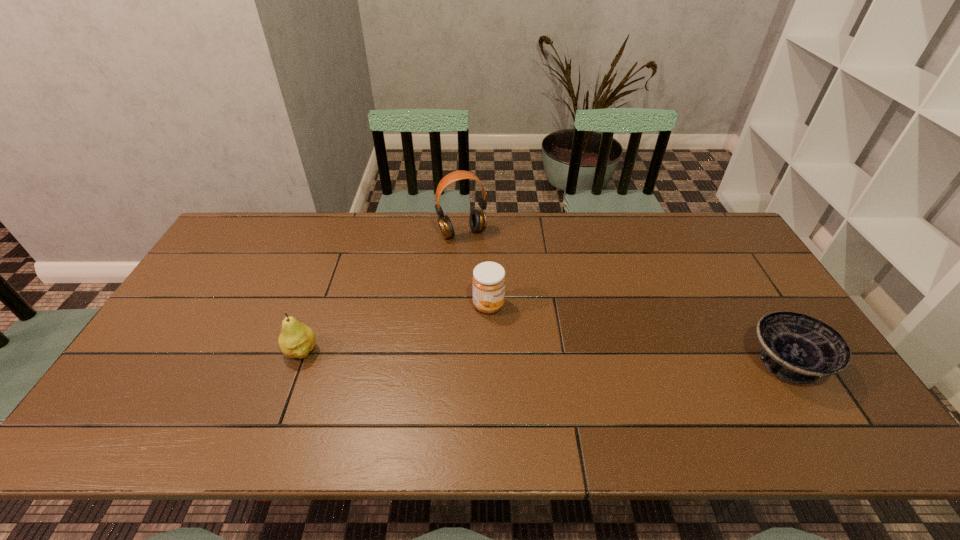
You are a GUI agent. You are given a task and a screenshot of the screen. Output one action in this format:
    pyautogui.click(x=<x>, y=<y>)
    Task: Click on the free space between the pear and the tallest object
    
    Given the screenshot: What is the action you would take?
    pyautogui.click(x=382, y=292)

This screenshot has height=540, width=960. I want to click on free space between the second farthest object and the pear, so click(x=395, y=328).

Identify the location of object that is the second closest to the jam. This screenshot has width=960, height=540. pyautogui.click(x=296, y=340).

Choose which object is the third nearest neighbor to the bowl. Please provide its 2D coordinates. Your answer should be formatted as a tuple, i.e. [(x, y)], where the tuple contains the x and y coordinates of a point satisfying the conditions above.

[(296, 340)]

In order to click on vacant region that satisfies the following two spatial constraints: 1. on the front side of the headset; 2. on the right side of the second farthest object in this screenshot , I will do `click(459, 305)`.

Identify the location of free spot that satisfies the following two spatial constraints: 1. on the back side of the third nearest object; 2. on the left side of the leftmost object. The image size is (960, 540). (318, 305).

At what (x,y) coordinates should I click in order to perform the action: click on vacant region that satisfies the following two spatial constraints: 1. on the front side of the headset; 2. on the right side of the shortest object. Please return your answer as a coordinate pair (x, y). Image resolution: width=960 pixels, height=540 pixels. Looking at the image, I should click on (456, 363).

The image size is (960, 540). Find the location of `vacant region that satisfies the following two spatial constraints: 1. on the back side of the leftmost object; 2. on the right side of the tallest object`. vacant region that satisfies the following two spatial constraints: 1. on the back side of the leftmost object; 2. on the right side of the tallest object is located at coordinates click(345, 233).